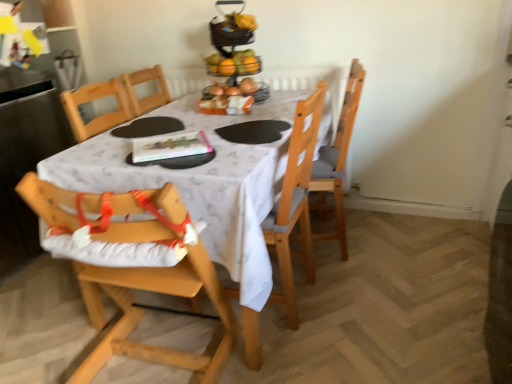
Question: From the image's perspective, is orange plastic basket at center over wooden chair at right, marked as the 3th chair in a left-to-right arrangement?

Choices:
 (A) no
 (B) yes

Answer: (B)

Question: Is orange plastic basket at center turned away from wooden chair at right, marked as the 3th chair in a left-to-right arrangement?

Choices:
 (A) yes
 (B) no

Answer: (B)

Question: From the image's perspective, is orange plastic basket at center below wooden chair at right, which appears as the 1th chair when viewed from the right?

Choices:
 (A) no
 (B) yes

Answer: (A)

Question: Considering the relative sizes of orange plastic basket at center and wooden chair at right, which appears as the 1th chair when viewed from the right, in the image provided, is orange plastic basket at center bigger than wooden chair at right, which appears as the 1th chair when viewed from the right,?

Choices:
 (A) no
 (B) yes

Answer: (A)

Question: Is orange plastic basket at center oriented towards wooden chair at right, marked as the 3th chair in a left-to-right arrangement?

Choices:
 (A) yes
 (B) no

Answer: (B)

Question: Looking at their shapes, would you say white fabric table at center is wider or thinner than wooden highchair at lower left, the third chair when ordered from right to left?

Choices:
 (A) wide
 (B) thin

Answer: (A)

Question: From a real-world perspective, is white fabric table at center physically located above or below wooden highchair at lower left, the third chair when ordered from right to left?

Choices:
 (A) above
 (B) below

Answer: (B)

Question: In the image, is white fabric table at center on the left side or the right side of wooden highchair at lower left, the third chair when ordered from right to left?

Choices:
 (A) right
 (B) left

Answer: (A)

Question: From the image's perspective, is white fabric table at center above or below wooden highchair at lower left, positioned as the 1th chair in left-to-right order?

Choices:
 (A) below
 (B) above

Answer: (B)

Question: Is orange plastic basket at center taller or shorter than wooden highchair at lower left, positioned as the 1th chair in left-to-right order?

Choices:
 (A) tall
 (B) short

Answer: (B)

Question: Considering the positions of orange plastic basket at center and wooden highchair at lower left, positioned as the 1th chair in left-to-right order, in the image, is orange plastic basket at center wider or thinner than wooden highchair at lower left, positioned as the 1th chair in left-to-right order,?

Choices:
 (A) thin
 (B) wide

Answer: (A)

Question: Would you say orange plastic basket at center is inside or outside wooden highchair at lower left, the third chair when ordered from right to left?

Choices:
 (A) outside
 (B) inside

Answer: (A)

Question: Does point (211, 109) appear closer or farther from the camera than point (129, 210)?

Choices:
 (A) closer
 (B) farther

Answer: (B)

Question: Is orange plastic basket at center inside the boundaries of white fabric table at center, or outside?

Choices:
 (A) outside
 (B) inside

Answer: (A)

Question: Considering the positions of orange plastic basket at center and white fabric table at center in the image, is orange plastic basket at center bigger or smaller than white fabric table at center?

Choices:
 (A) big
 (B) small

Answer: (B)